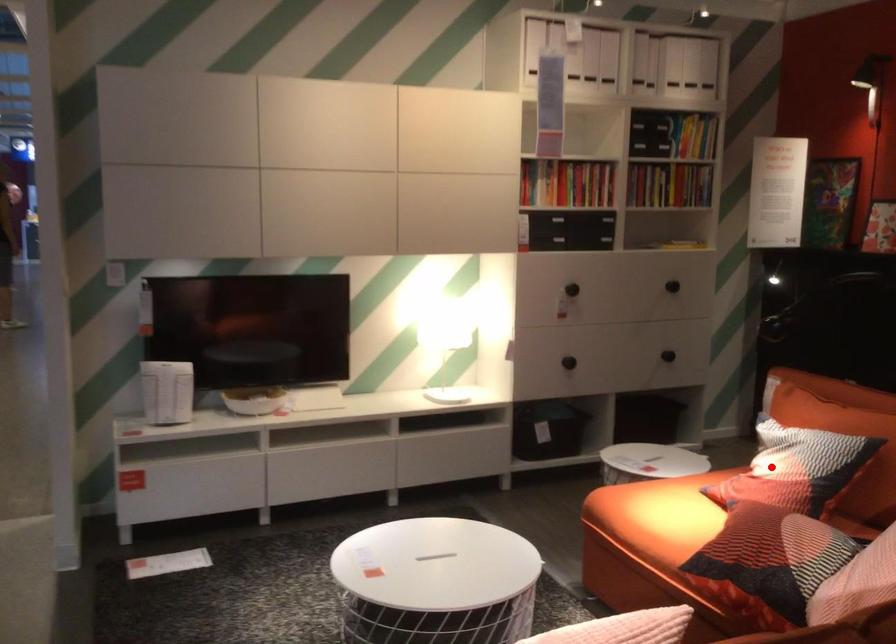
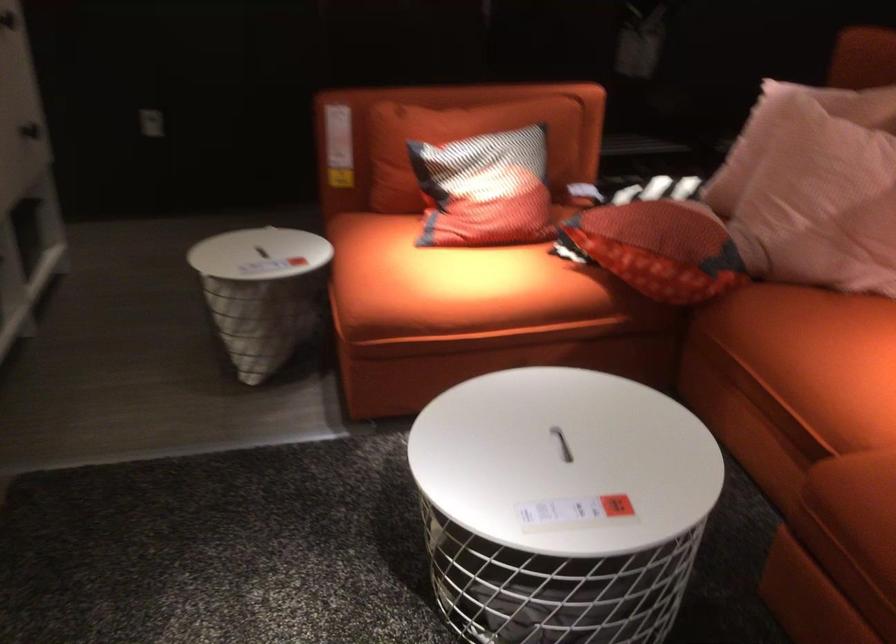
Where in the second image is the point corresponding to the highlighted location from the first image?

(485, 190)